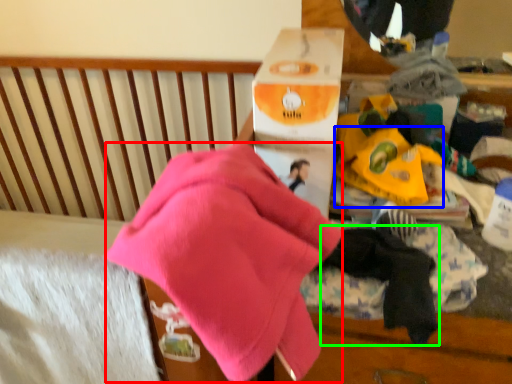
Question: Which is nearer to the underclothes (highlighted by a red box)? toy (highlighted by a blue box) or baby clothe (highlighted by a green box).

Choices:
 (A) toy
 (B) baby clothe

Answer: (B)